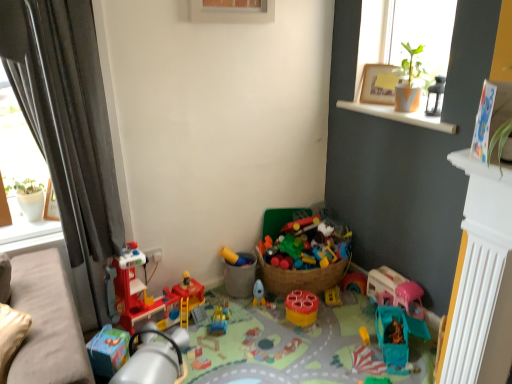
You are a GUI agent. You are given a task and a screenshot of the screen. Output one action in this format:
    pyautogui.click(x=<x>, y=<y>)
    Task: Click on the free space between pink plastic toy at lower right, positioned as the 1th toy in right-to-left order, and matte plastic cup at center, the sixth toy from the left
    Image resolution: width=512 pixels, height=384 pixels.
    Given the screenshot: What is the action you would take?
    pyautogui.click(x=343, y=310)